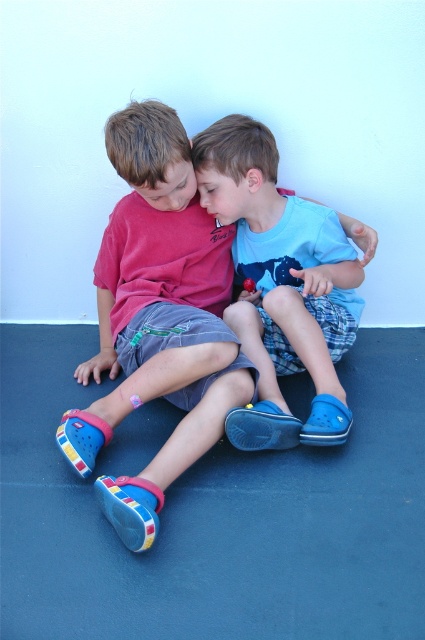
Question: Is matte pink shorts at center below blue rubber shoes at center?

Choices:
 (A) yes
 (B) no

Answer: (A)

Question: Considering the relative positions of matte pink shorts at center and blue rubber shoes at center in the image provided, where is matte pink shorts at center located with respect to blue rubber shoes at center?

Choices:
 (A) above
 (B) below

Answer: (B)

Question: Which of the following is the closest to the observer?

Choices:
 (A) matte pink shorts at center
 (B) blue rubber shoes at center

Answer: (A)

Question: Among these objects, which one is nearest to the camera?

Choices:
 (A) blue rubber shoes at center
 (B) matte pink shorts at center

Answer: (B)

Question: Is matte pink shorts at center below blue rubber shoes at center?

Choices:
 (A) yes
 (B) no

Answer: (A)

Question: Among these points, which one is farthest from the camera?

Choices:
 (A) (76, 432)
 (B) (257, 301)

Answer: (B)